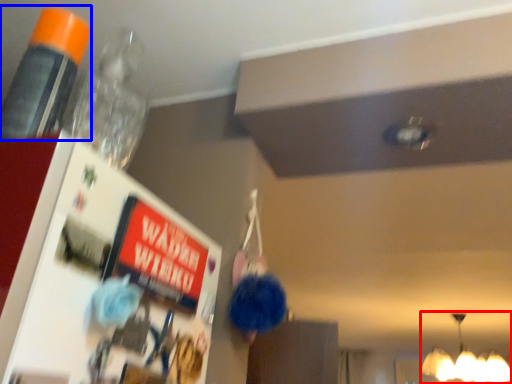
Question: Which of the following is the farthest to the observer, lamp (highlighted by a red box) or bottle (highlighted by a blue box)?

Choices:
 (A) lamp
 (B) bottle

Answer: (A)